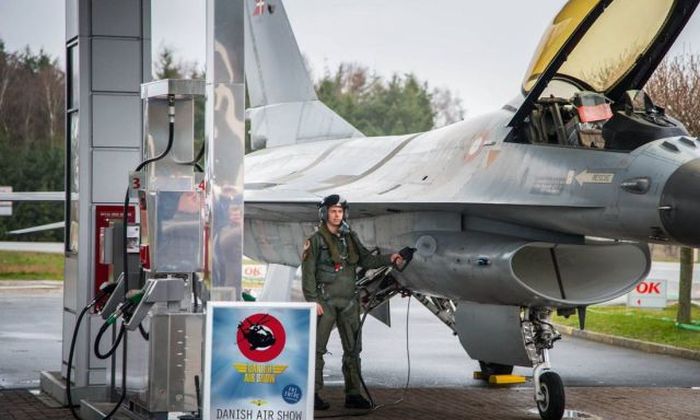
Locate an element on the screen. air show poster is located at coordinates (259, 374).